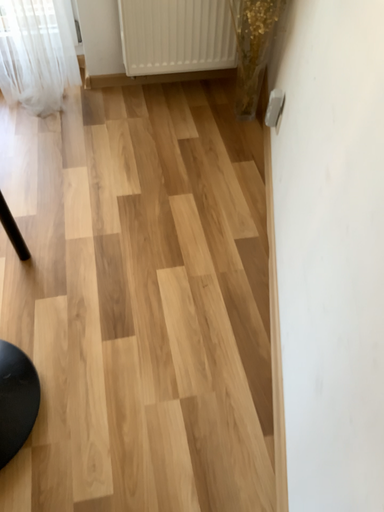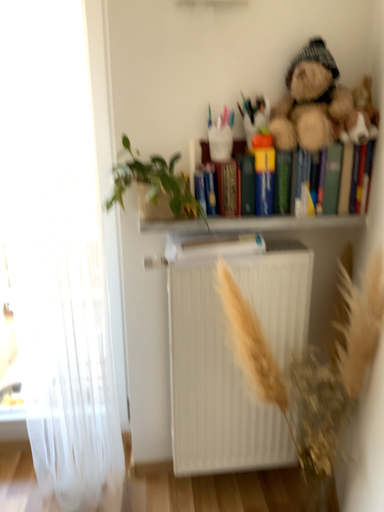
Question: Which way did the camera rotate in the video?

Choices:
 (A) rotated downward
 (B) rotated upward

Answer: (B)